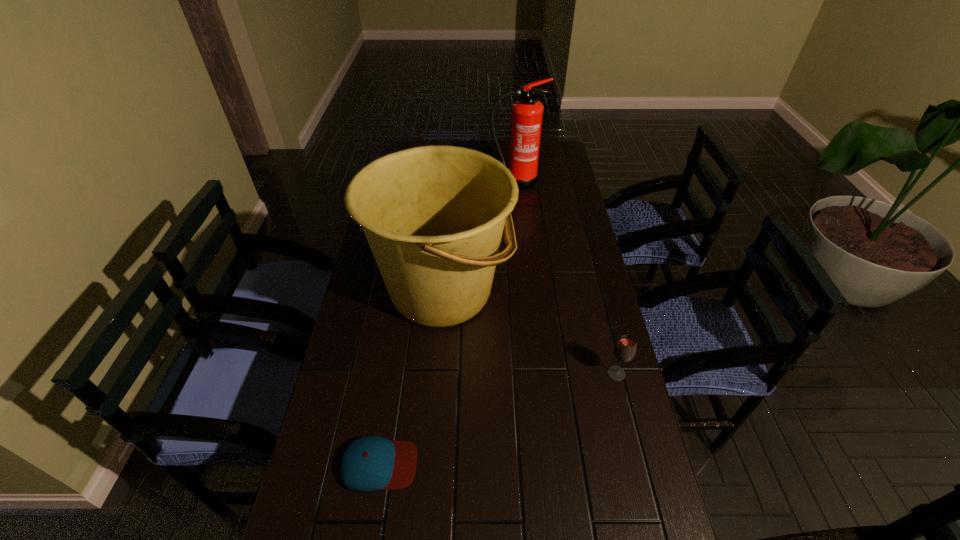
Locate an element on the screen. The width and height of the screenshot is (960, 540). bucket that is at the left edge is located at coordinates (433, 216).

Locate an element on the screen. baseball cap located at the left edge is located at coordinates [x=369, y=463].

Where is `fire extinguisher that is positioned at the right edge`? fire extinguisher that is positioned at the right edge is located at coordinates (527, 113).

Locate an element on the screen. The width and height of the screenshot is (960, 540). glass drink container at the right edge is located at coordinates (625, 349).

In the image, there is a desktop. Where is `free region at the far edge`? free region at the far edge is located at coordinates (479, 144).

Find the location of `free location at the left edge of the desktop`. free location at the left edge of the desktop is located at coordinates (395, 363).

Find the location of `vacant space at the right edge`. vacant space at the right edge is located at coordinates (588, 342).

Where is `free space at the far right corner of the desktop`? The width and height of the screenshot is (960, 540). free space at the far right corner of the desktop is located at coordinates (540, 161).

What are the coordinates of `free space between the second shortest object and the second farthest object` in the screenshot? It's located at (529, 332).

Where is `vacant area between the shortest object and the third tallest object`? The image size is (960, 540). vacant area between the shortest object and the third tallest object is located at coordinates (497, 419).